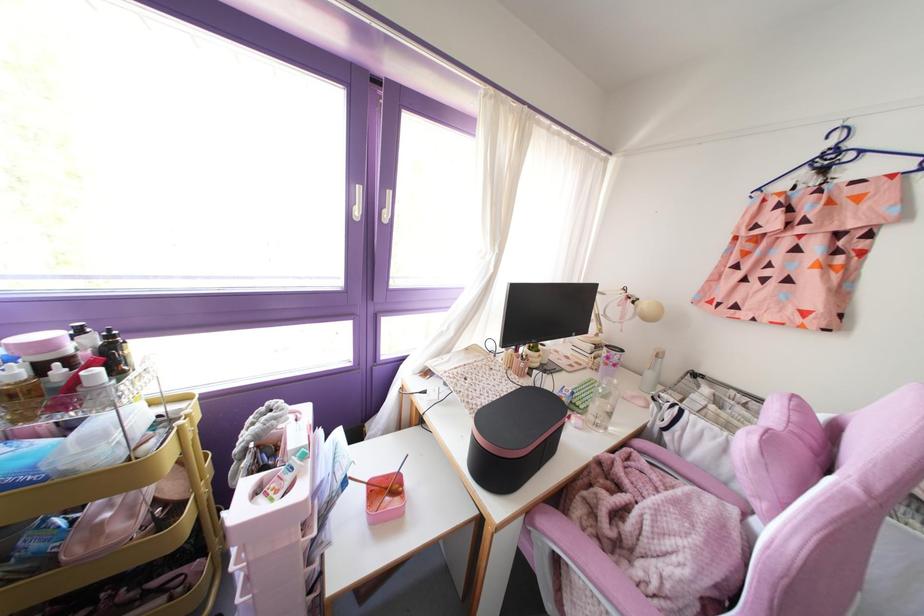
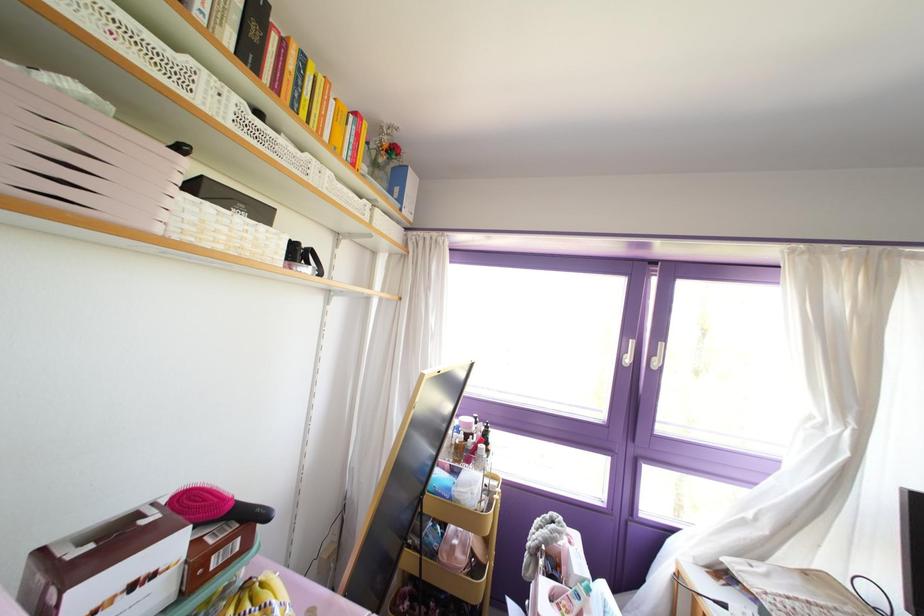
Where in the second image is the point corresponding to pixel 357 212 from the first image?

(626, 360)